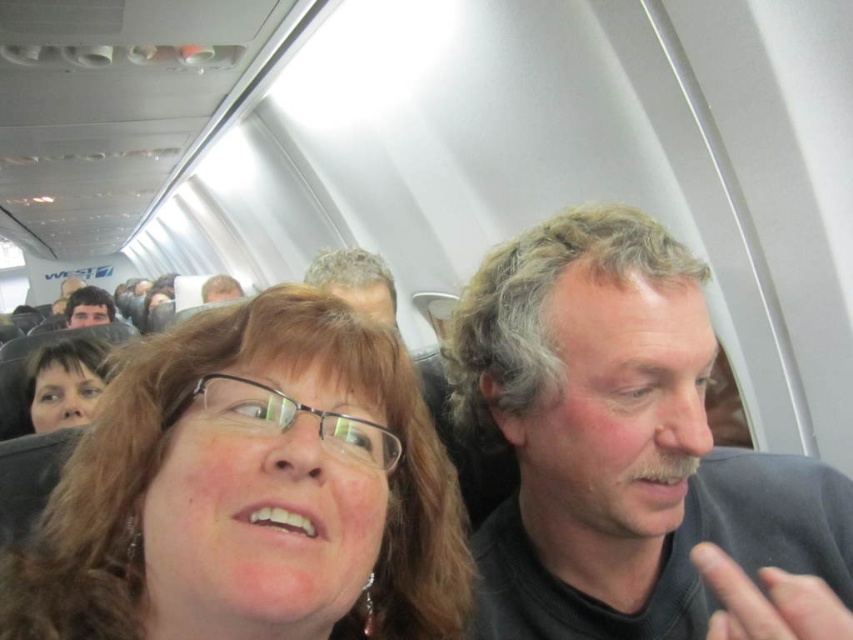
You are a flight attendant checking the safety of passengers. You notice the matte black glasses at center and the gray hair man at center. Which object is wider in terms of their physical dimensions?

The matte black glasses at center might be wider than gray hair man at center according to the description.

You are a photographer trying to capture a photo of the airplane cabin. You notice two points in the image labeled as point (x=204, y=316) and point (x=473, y=493). Which point is closer to your camera?

Point (x=204, y=316) is closer to the camera than point (x=473, y=493).

From the picture: You are a flight attendant checking the cabin. You notice the gray hair at center and the smooth skin face at upper left. Which object has a smaller width?

The gray hair at center has a lesser width compared to the smooth skin face at upper left.